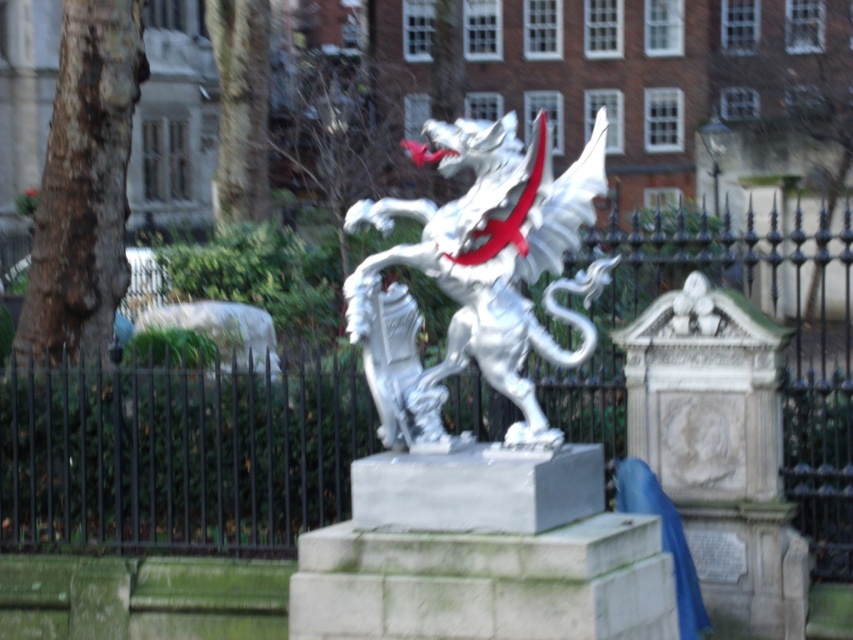
You are a visitor at the park and want to take a photo of the white marble dragon at center without the black metal fence at center appearing in the background. Is it possible to do so based on their heights?

The black metal fence at center is much taller than the white marble dragon at center, so it will likely appear in the background when taking a photo of the dragon. Therefore, it might not be possible to avoid the fence in the background.

You are a delivery person with a cart that is 2 meters wide. You need to move your cart from the black metal fence at center to the white marble dragon at center. Is there enough space between them for your cart to pass through?

The distance between the black metal fence at center and the white marble dragon at center is 6.28 meters. Since your cart is only 2 meters wide, there is sufficient space for the cart to pass through as the distance is greater than the cart width.

You are a visitor in the park and want to take a photo of the white marble dragon at center without the black metal fence at center appearing in the background. Is it possible to do so based on their sizes?

The black metal fence at center is larger in size than the white marble dragon at center, so it might be challenging to frame the dragon without the fence appearing in the background. Adjust your position or zoom in to focus solely on the dragon.